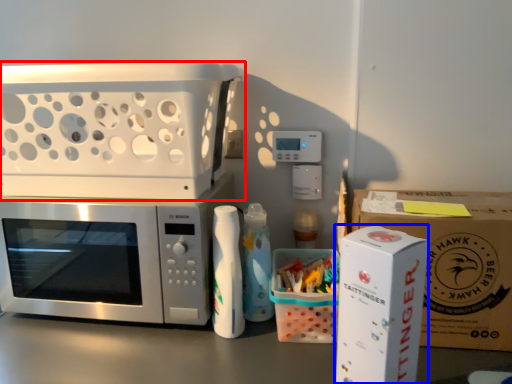
Question: Among these objects, which one is nearest to the camera, appliance (highlighted by a red box) or appliance (highlighted by a blue box)?

Choices:
 (A) appliance
 (B) appliance

Answer: (B)